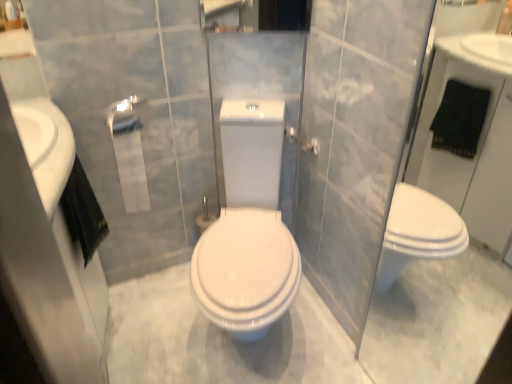
Describe the element at coordinates (302, 141) in the screenshot. The height and width of the screenshot is (384, 512). I see `silver metallic towel bar at upper center` at that location.

Describe the element at coordinates (129, 159) in the screenshot. I see `white matte toilet paper at center` at that location.

Locate an element on the screen. The width and height of the screenshot is (512, 384). white glossy sink at left is located at coordinates click(x=46, y=147).

Find the location of a particular element. The width and height of the screenshot is (512, 384). silver metallic towel bar at upper center is located at coordinates (302, 141).

Between white matte toilet paper at center and white glossy sink at left, which one is positioned in front?

white glossy sink at left is closer to the camera.

Is point (135, 169) less distant than point (22, 111)?

No, (135, 169) is behind (22, 111).

Considering the relative sizes of white matte toilet paper at center and white glossy sink at left in the image provided, is white matte toilet paper at center taller than white glossy sink at left?

Yes, white matte toilet paper at center is taller than white glossy sink at left.

In the scene shown: Considering the positions of objects white matte toilet paper at center and silver metallic towel bar at upper center in the image provided, who is more to the left, white matte toilet paper at center or silver metallic towel bar at upper center?

From the viewer's perspective, white matte toilet paper at center appears more on the left side.

Is white matte toilet paper at center wider or thinner than silver metallic towel bar at upper center?

white matte toilet paper at center is wider than silver metallic towel bar at upper center.

From the picture: Is the depth of white matte toilet paper at center greater than that of silver metallic towel bar at upper center?

No, white matte toilet paper at center is closer to the viewer.

Considering the points (46, 109) and (307, 146), which point is behind, point (46, 109) or point (307, 146)?

Positioned behind is point (307, 146).

Are white glossy sink at left and silver metallic towel bar at upper center beside each other?

There is a gap between white glossy sink at left and silver metallic towel bar at upper center.

From the image's perspective, would you say white glossy sink at left is shown under silver metallic towel bar at upper center?

Yes.

In the image, is white glossy sink at left on the left side or the right side of silver metallic towel bar at upper center?

Based on their positions, white glossy sink at left is located to the left of silver metallic towel bar at upper center.

Measure the distance between white glossy sink at left and white matte toilet paper at center.

white glossy sink at left and white matte toilet paper at center are 12.79 inches apart from each other.

Considering the positions of objects white glossy sink at left and white matte toilet paper at center in the image provided, who is behind, white glossy sink at left or white matte toilet paper at center?

white matte toilet paper at center.

Does white glossy sink at left touch white matte toilet paper at center?

There is a gap between white glossy sink at left and white matte toilet paper at center.

From the image's perspective, which one is positioned higher, white glossy sink at left or white matte toilet paper at center?

white matte toilet paper at center, from the image's perspective.

Does point (428, 41) appear closer or farther from the camera than point (308, 146)?

Point (428, 41).

Is transparent glass door at right placed right next to silver metallic towel bar at upper center?

There is a gap between transparent glass door at right and silver metallic towel bar at upper center.

Based on the photo, from the image's perspective, is transparent glass door at right positioned above or below silver metallic towel bar at upper center?

transparent glass door at right is situated lower than silver metallic towel bar at upper center in the image.

Consider the image. Between transparent glass door at right and silver metallic towel bar at upper center, which one is positioned behind?

silver metallic towel bar at upper center.

Consider the image. Which is more to the right, silver metallic towel bar at upper center or white glossy sink at left?

From the viewer's perspective, silver metallic towel bar at upper center appears more on the right side.

From a real-world perspective, does silver metallic towel bar at upper center sit lower than white glossy sink at left?

Correct, in the physical world, silver metallic towel bar at upper center is lower than white glossy sink at left.

From the image's perspective, which is above, silver metallic towel bar at upper center or white glossy sink at left?

silver metallic towel bar at upper center appears higher in the image.

Does silver metallic towel bar at upper center have a larger size compared to white glossy sink at left?

No.

Is white glossy sink at left bigger than transparent glass door at right?

Actually, white glossy sink at left might be smaller than transparent glass door at right.

Is the depth of white glossy sink at left greater than that of transparent glass door at right?

Yes, the depth of white glossy sink at left is greater than that of transparent glass door at right.

From the image's perspective, between white glossy sink at left and transparent glass door at right, which one is located above?

white glossy sink at left is shown above in the image.

Considering the relative positions of white glossy sink at left and transparent glass door at right in the image provided, is white glossy sink at left to the right of transparent glass door at right from the viewer's perspective?

In fact, white glossy sink at left is to the left of transparent glass door at right.

Where is `sink above the white matte toilet paper at center (from a real-world perspective)`? sink above the white matte toilet paper at center (from a real-world perspective) is located at coordinates (46, 147).

In the image, there is a silver metallic towel bar at upper center. Where is `toilet paper below it (from a real-world perspective)`? The height and width of the screenshot is (384, 512). toilet paper below it (from a real-world perspective) is located at coordinates (129, 159).

When comparing their distances from white glossy sink at left, does white matte toilet paper at center or silver metallic towel bar at upper center seem further?

silver metallic towel bar at upper center is further to white glossy sink at left.

Looking at the image, which one is located further to white glossy sink at left, white matte toilet paper at center or transparent glass door at right?

transparent glass door at right is further to white glossy sink at left.

When comparing their distances from silver metallic towel bar at upper center, does white glossy sink at left or white matte toilet paper at center seem further?

white glossy sink at left is positioned further to the anchor silver metallic towel bar at upper center.

Based on their spatial positions, is white glossy sink at left or transparent glass door at right further from white matte toilet paper at center?

transparent glass door at right.

Looking at the image, which one is located closer to white matte toilet paper at center, white glossy sink at left or silver metallic towel bar at upper center?

white glossy sink at left is closer to white matte toilet paper at center.

When comparing their distances from transparent glass door at right, does silver metallic towel bar at upper center or white glossy sink at left seem closer?

silver metallic towel bar at upper center is positioned closer to the anchor transparent glass door at right.

Based on their spatial positions, is white matte toilet paper at center or white glossy sink at left closer to silver metallic towel bar at upper center?

white matte toilet paper at center lies closer to silver metallic towel bar at upper center than the other object.

Which object lies further to the anchor point silver metallic towel bar at upper center, transparent glass door at right or white matte toilet paper at center?

Among the two, transparent glass door at right is located further to silver metallic towel bar at upper center.

You are a GUI agent. You are given a task and a screenshot of the screen. Output one action in this format:
    pyautogui.click(x=<x>, y=<y>)
    Task: Click on the towel bar between white glossy sink at left and transparent glass door at right in the horizontal direction
    
    Given the screenshot: What is the action you would take?
    pos(302,141)

This screenshot has height=384, width=512. In order to click on toilet paper between white glossy sink at left and silver metallic towel bar at upper center in the horizontal direction in this screenshot , I will do `click(129, 159)`.

The height and width of the screenshot is (384, 512). I want to click on toilet paper between transparent glass door at right and silver metallic towel bar at upper center in the front-back direction, so click(129, 159).

You are a GUI agent. You are given a task and a screenshot of the screen. Output one action in this format:
    pyautogui.click(x=<x>, y=<y>)
    Task: Click on the toilet paper between white glossy sink at left and transparent glass door at right from left to right
    This screenshot has height=384, width=512.
    Given the screenshot: What is the action you would take?
    pyautogui.click(x=129, y=159)